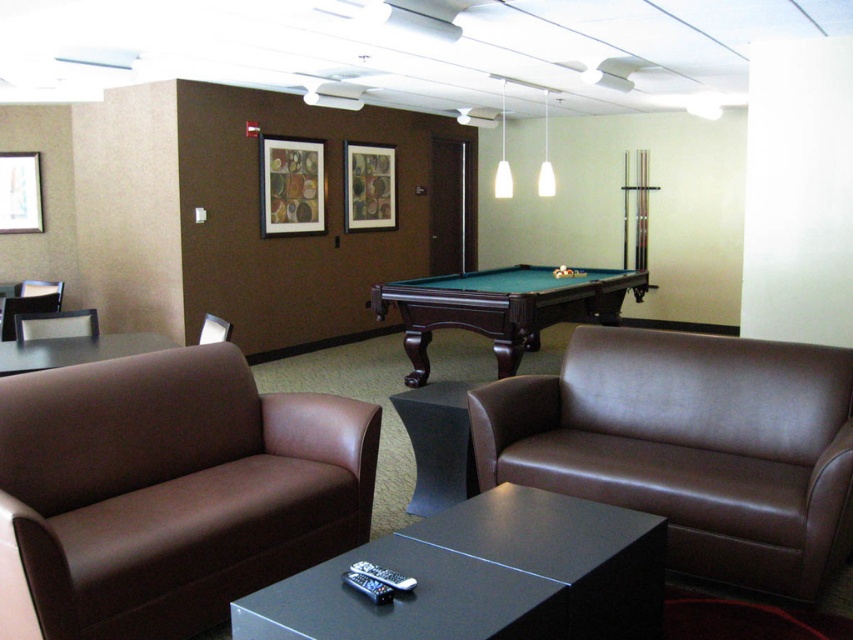
Between brown leather chair at left and brown leather chair at center, which one appears on the left side from the viewer's perspective?

Positioned to the left is brown leather chair at left.

Can you confirm if brown leather chair at left is thinner than brown leather chair at center?

In fact, brown leather chair at left might be wider than brown leather chair at center.

At what (x,y) coordinates should I click in order to perform the action: click on brown leather chair at left. Please return your answer as a coordinate pair (x, y). Looking at the image, I should click on (24, 308).

What are the coordinates of `brown leather chair at left` in the screenshot? It's located at (24, 308).

Which is more to the right, green felt pool table at center or black glass table at lower left?

From the viewer's perspective, green felt pool table at center appears more on the right side.

Which is in front, point (456, 305) or point (3, 355)?

Point (3, 355) is more forward.

Find the location of a particular element. Image resolution: width=853 pixels, height=640 pixels. green felt pool table at center is located at coordinates (502, 307).

Can you confirm if green felt pool table at center is shorter than brown leather chair at left?

Incorrect, green felt pool table at center's height does not fall short of brown leather chair at left's.

The image size is (853, 640). I want to click on green felt pool table at center, so click(x=502, y=307).